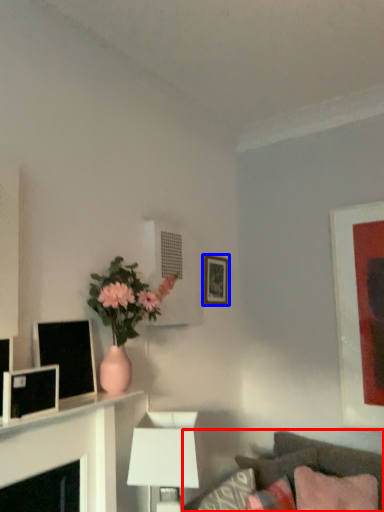
Question: Which object is further to the camera taking this photo, studio couch (highlighted by a red box) or picture frame (highlighted by a blue box)?

Choices:
 (A) studio couch
 (B) picture frame

Answer: (B)